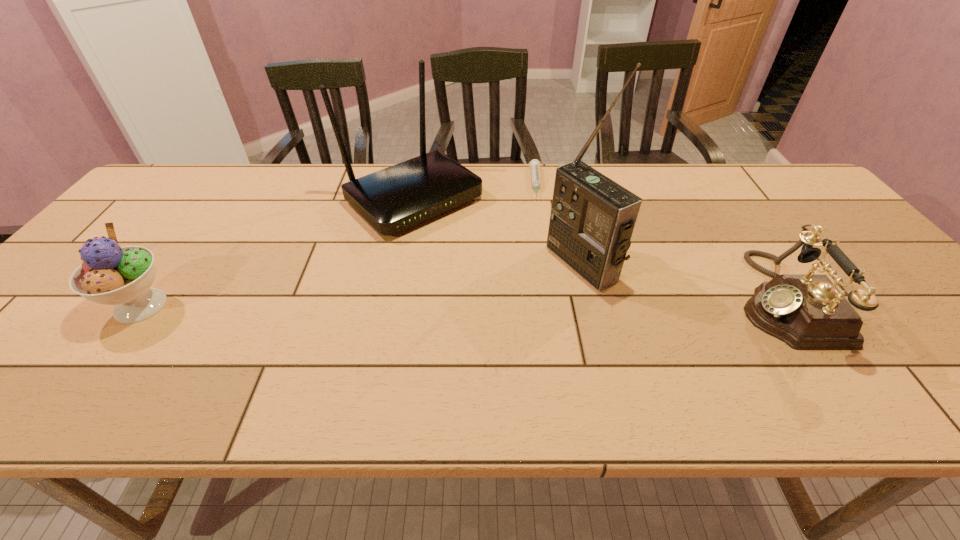
Identify the location of vacant region located 0.240m on the display of the radio receiver. (474, 320).

At what (x,y) coordinates should I click in order to perform the action: click on free point located on the display of the radio receiver. Please return your answer as a coordinate pair (x, y). Image resolution: width=960 pixels, height=540 pixels. Looking at the image, I should click on (538, 289).

The image size is (960, 540). Find the location of `vacant space located on the display of the radio receiver`. vacant space located on the display of the radio receiver is located at coordinates (514, 300).

What are the coordinates of `free space located on the front-facing side of the fourth shortest object` in the screenshot? It's located at (523, 288).

Find the location of a particular element. The image size is (960, 540). free space located on the front-facing side of the fourth shortest object is located at coordinates (484, 256).

This screenshot has width=960, height=540. Identify the location of vacant region located on the front-facing side of the fourth shortest object. [x=526, y=291].

Image resolution: width=960 pixels, height=540 pixels. In order to click on free region located 0.100m at the needle end of the shortest object in this screenshot , I will do `click(541, 222)`.

You are a GUI agent. You are given a task and a screenshot of the screen. Output one action in this format:
    pyautogui.click(x=<x>, y=<y>)
    Task: Click on the free space located at the needle end of the shortest object
    The height and width of the screenshot is (540, 960).
    Given the screenshot: What is the action you would take?
    pyautogui.click(x=542, y=231)

Identify the location of vacant space situated 0.200m at the needle end of the shortest object. This screenshot has height=540, width=960. [x=543, y=245].

You are a GUI agent. You are given a task and a screenshot of the screen. Output one action in this format:
    pyautogui.click(x=<x>, y=<y>)
    Task: Click on the router present at the far edge
    This screenshot has width=960, height=540.
    Given the screenshot: What is the action you would take?
    pyautogui.click(x=393, y=199)